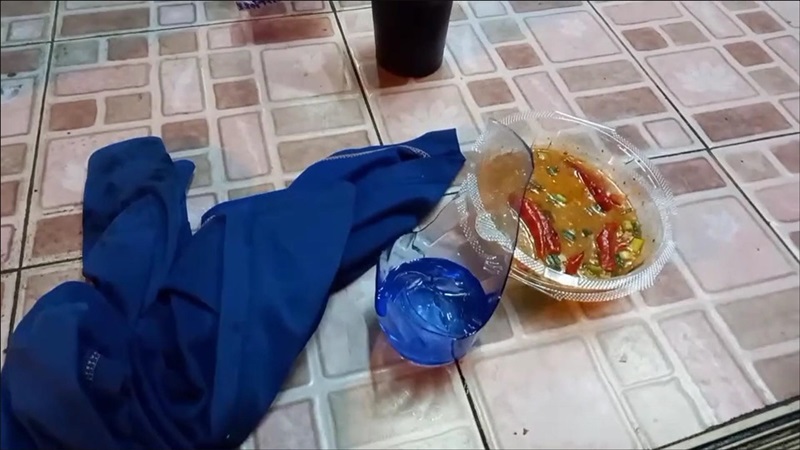
Find the location of a particular element. crack between parts of table is located at coordinates (470, 404).